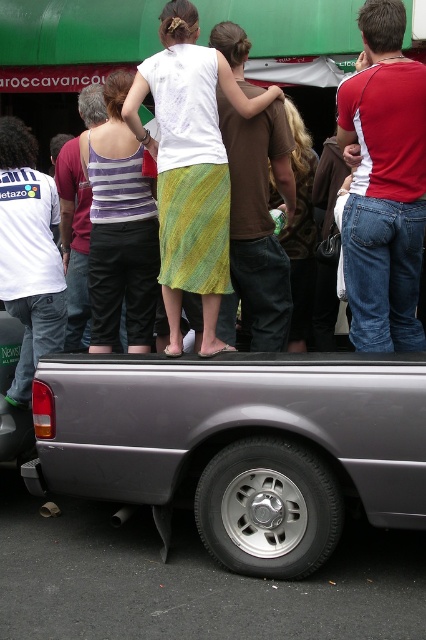
Question: Is striped fabric tank top at center behind white jersey at left?

Choices:
 (A) no
 (B) yes

Answer: (A)

Question: Which point is farther from the camera taking this photo?

Choices:
 (A) (43, 237)
 (B) (120, 188)

Answer: (A)

Question: Which object appears closest to the camera in this image?

Choices:
 (A) metallic gray truck at lower center
 (B) white jersey at left

Answer: (A)

Question: Is matte black truck at center bigger than white jersey at left?

Choices:
 (A) yes
 (B) no

Answer: (A)

Question: Which point appears closest to the camera in this image?

Choices:
 (A) pyautogui.click(x=264, y=497)
 (B) pyautogui.click(x=330, y=515)
 (C) pyautogui.click(x=138, y=116)
 (D) pyautogui.click(x=363, y=342)

Answer: (B)

Question: Is the position of metallic gray truck at lower center more distant than that of matte black truck at center?

Choices:
 (A) no
 (B) yes

Answer: (A)